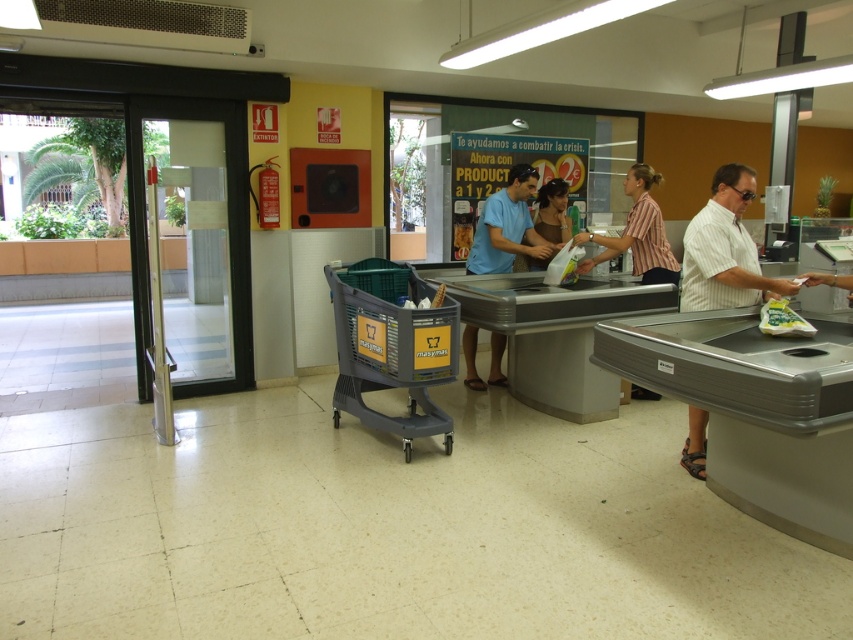
Question: Estimate the real-world distances between objects in this image. Which object is farther from the white striped shirt at right?

Choices:
 (A) blue cotton shirt at center
 (B) gray plastic shopping cart at center

Answer: (B)

Question: Does white striped shirt at right have a smaller size compared to striped cotton shirt at center?

Choices:
 (A) no
 (B) yes

Answer: (B)

Question: Can you confirm if white striped shirt at right is positioned to the right of blue cotton shirt at center?

Choices:
 (A) no
 (B) yes

Answer: (B)

Question: Among these points, which one is farthest from the camera?

Choices:
 (A) (444, 336)
 (B) (637, 198)
 (C) (514, 179)

Answer: (C)

Question: Which object is closer to the camera taking this photo?

Choices:
 (A) striped cotton shirt at center
 (B) gray plastic shopping cart at center

Answer: (B)

Question: Is white striped shirt at right below blue cotton shirt at center?

Choices:
 (A) yes
 (B) no

Answer: (A)